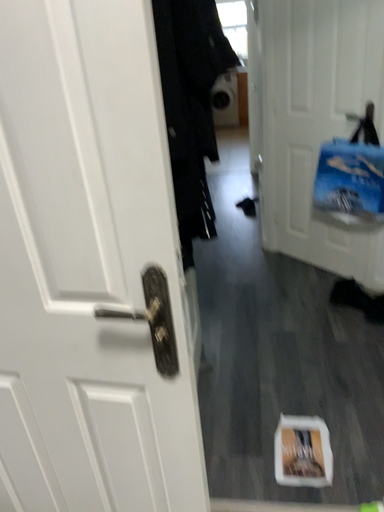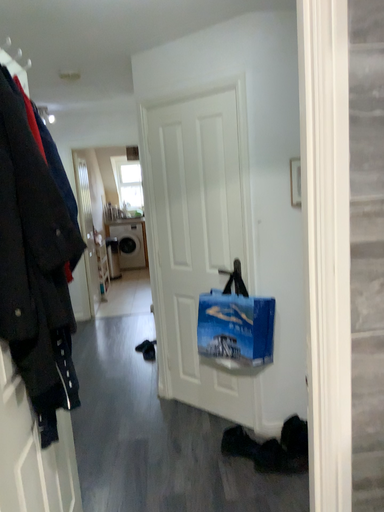
Question: How did the camera likely rotate when shooting the video?

Choices:
 (A) rotated right
 (B) rotated left

Answer: (A)